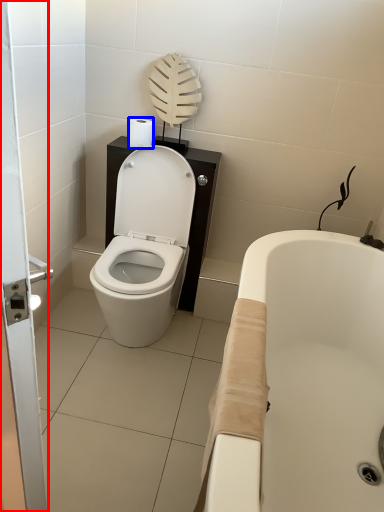
Question: Which point is further to the camera, screen door (highlighted by a red box) or toilet paper (highlighted by a blue box)?

Choices:
 (A) screen door
 (B) toilet paper

Answer: (B)